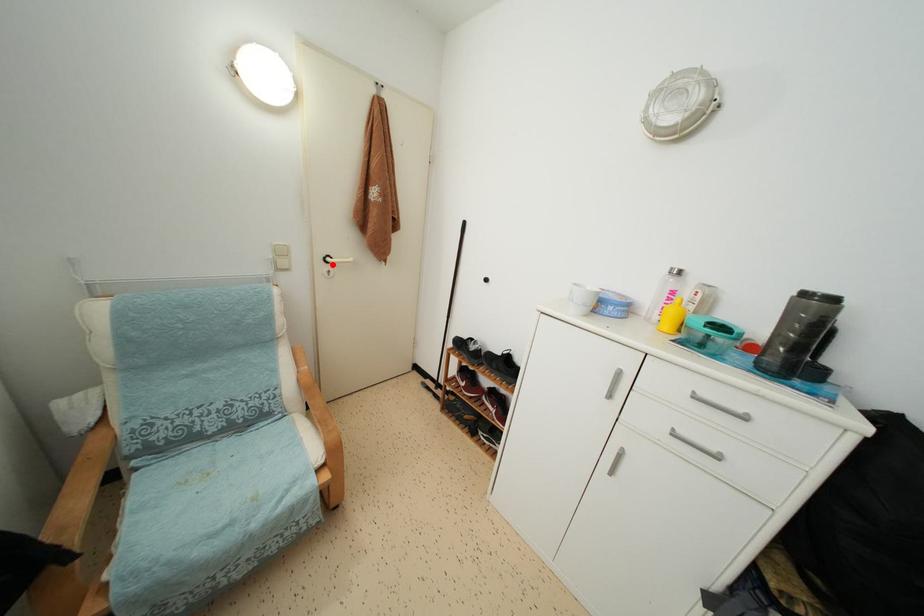
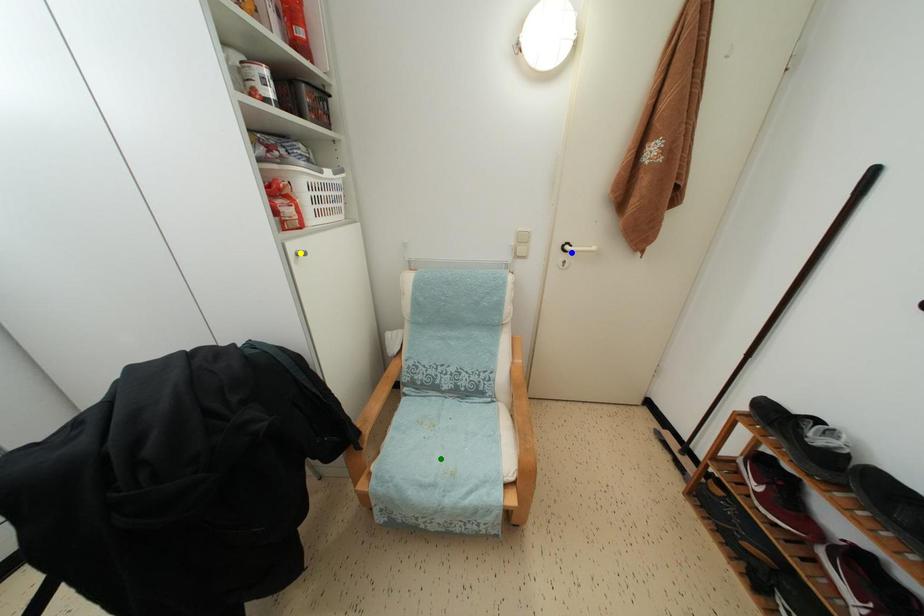
Question: I am providing you with two images of the same scene from different viewpoints. A red point is marked on the first image. You are given multiple points on the second image. Which mark in image 2 goes with the point in image 1?

Choices:
 (A) green point
 (B) blue point
 (C) yellow point

Answer: (B)